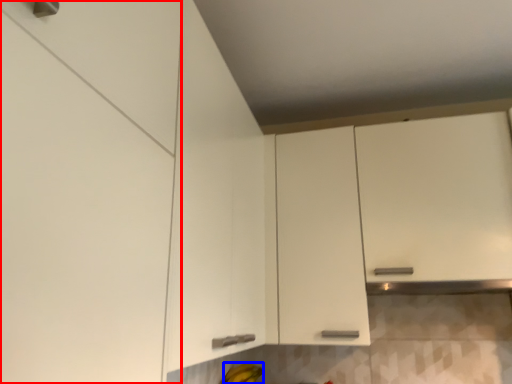
Question: Which object appears farthest to the camera in this image, cabinetry (highlighted by a red box) or banana (highlighted by a blue box)?

Choices:
 (A) cabinetry
 (B) banana

Answer: (B)